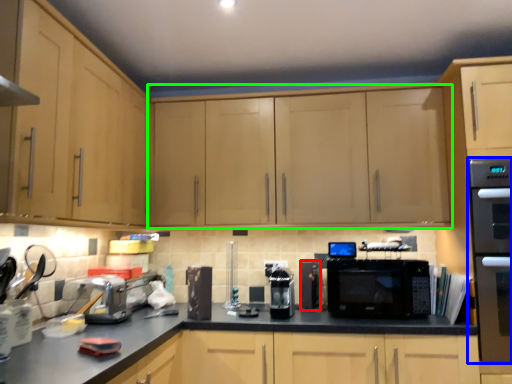
Question: Based on their relative distances, which object is farther from appliance (highlighted by a red box)? Choose from home appliance (highlighted by a blue box) and cabinetry (highlighted by a green box).

Choices:
 (A) home appliance
 (B) cabinetry

Answer: (A)